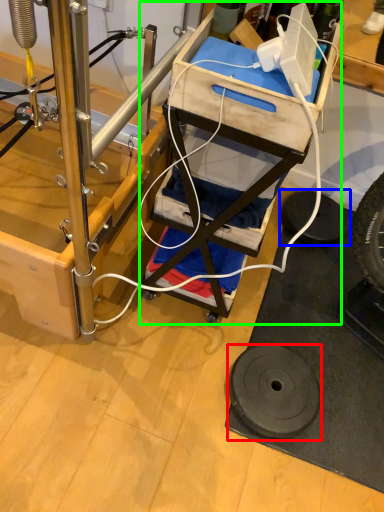
Question: Which object is positioned farthest from wheel (highlighted by a red box)? Select from tire (highlighted by a blue box) and furniture (highlighted by a green box).

Choices:
 (A) tire
 (B) furniture

Answer: (A)